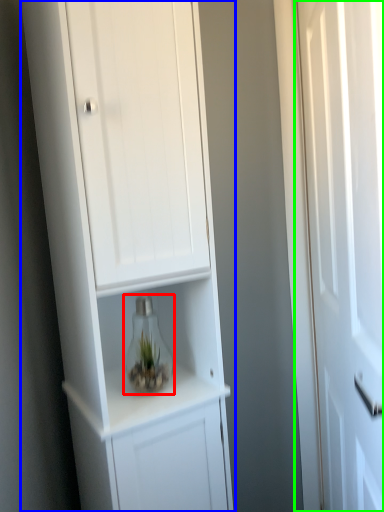
Question: Estimate the real-world distances between objects in this image. Which object is closer to glass vase (highlighted by a red box), cupboard (highlighted by a blue box) or door (highlighted by a green box)?

Choices:
 (A) cupboard
 (B) door

Answer: (A)